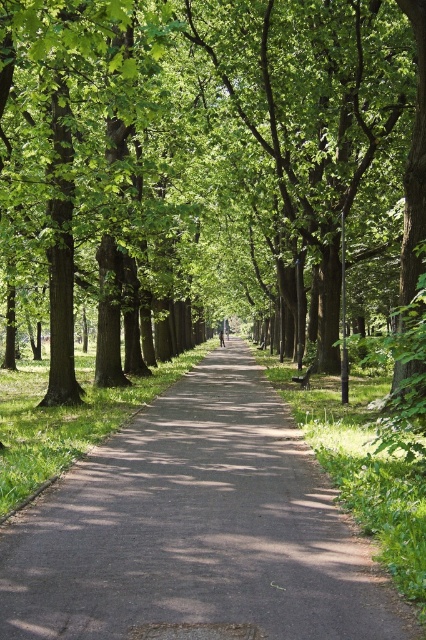
Question: Does green leafy tree at center have a lesser width compared to dark gray asphalt path at center?

Choices:
 (A) yes
 (B) no

Answer: (B)

Question: Does green leafy tree at center appear on the right side of dark gray asphalt path at center?

Choices:
 (A) yes
 (B) no

Answer: (B)

Question: Among these points, which one is nearest to the camera?

Choices:
 (A) (354, 243)
 (B) (236, 572)

Answer: (B)

Question: Which point appears closest to the camera in this image?

Choices:
 (A) (385, 628)
 (B) (367, 227)

Answer: (A)

Question: Does green leafy tree at center have a greater width compared to dark gray asphalt path at center?

Choices:
 (A) no
 (B) yes

Answer: (B)